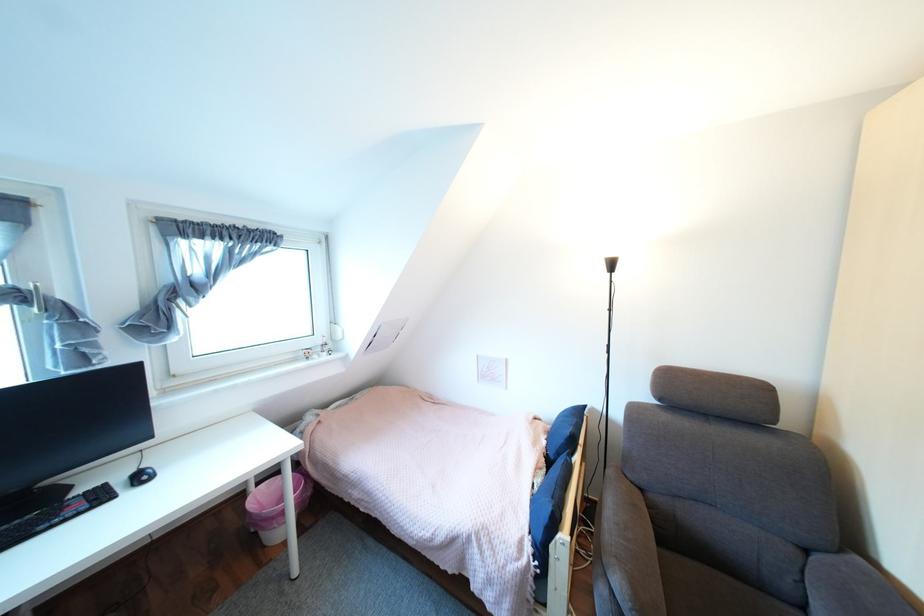
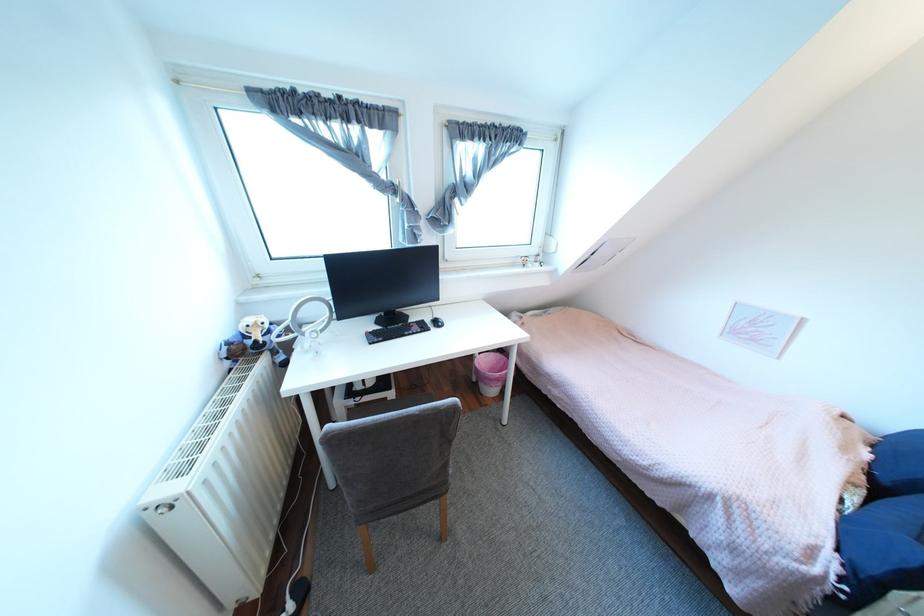
In the second image, find the point that corresponds to (x=112, y=496) in the first image.

(433, 326)